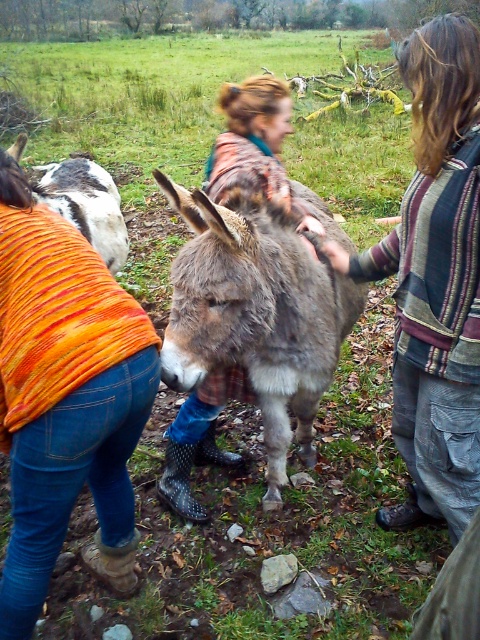
Question: Which point is farther from the camera taking this photo?

Choices:
 (A) (113, 193)
 (B) (425, 404)
 (C) (44, 595)

Answer: (A)

Question: Observing the image, what is the correct spatial positioning of striped wool sweater at center in reference to white fur donkey at left?

Choices:
 (A) above
 (B) below

Answer: (B)

Question: Which point is closer to the camera?

Choices:
 (A) (425, 492)
 (B) (120, 198)
 (C) (189, 195)

Answer: (C)

Question: Is orange knitted sweater at lower left smaller than fuzzy gray donkey at center?

Choices:
 (A) no
 (B) yes

Answer: (B)

Question: Which point is closer to the camera taking this photo?

Choices:
 (A) (15, 140)
 (B) (261, 323)
 (C) (405, 212)

Answer: (B)

Question: Observing the image, what is the correct spatial positioning of striped wool sweater at center in reference to white fur donkey at left?

Choices:
 (A) left
 (B) right

Answer: (B)